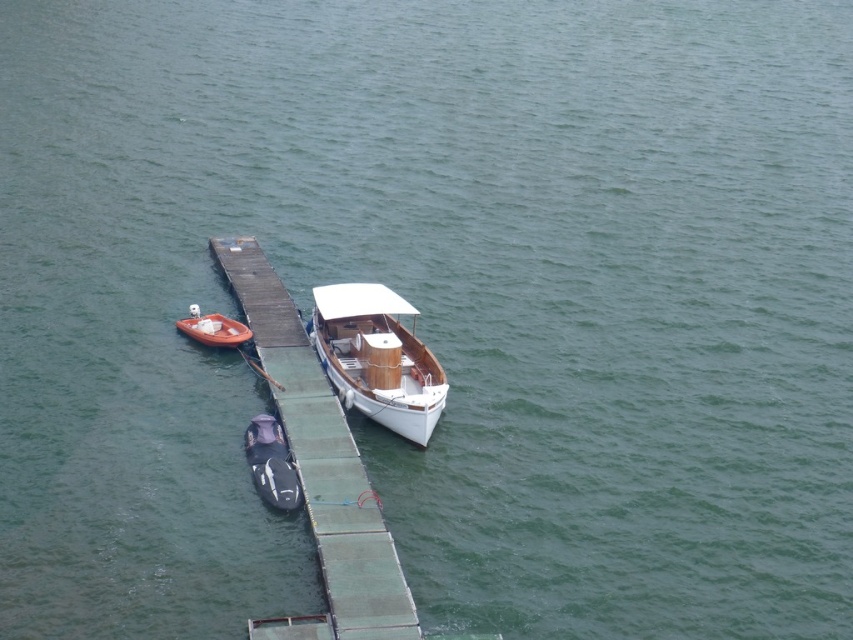
Where is `green wooden dock at center`? green wooden dock at center is located at coordinates (321, 464).

Between point (355, 604) and point (234, 333), which one is positioned in front?

Point (355, 604) is in front.

Where is `green wooden dock at center`? The image size is (853, 640). green wooden dock at center is located at coordinates tap(321, 464).

Where is `green wooden dock at center`? This screenshot has width=853, height=640. green wooden dock at center is located at coordinates (321, 464).

Can you confirm if black rubber kayak at center is bigger than orange matte boat at left?

Yes.

What do you see at coordinates (271, 465) in the screenshot?
I see `black rubber kayak at center` at bounding box center [271, 465].

Find the location of a particular element. This screenshot has height=640, width=853. black rubber kayak at center is located at coordinates (271, 465).

Looking at this image, does green wooden dock at center appear over white wood boat at center?

No.

Does point (397, 595) lie in front of point (434, 358)?

Yes, point (397, 595) is in front of point (434, 358).

Locate an element on the screen. The width and height of the screenshot is (853, 640). green wooden dock at center is located at coordinates (321, 464).